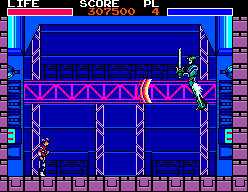
The height and width of the screenshot is (192, 248). Identify the location of right wall border. click(242, 105).